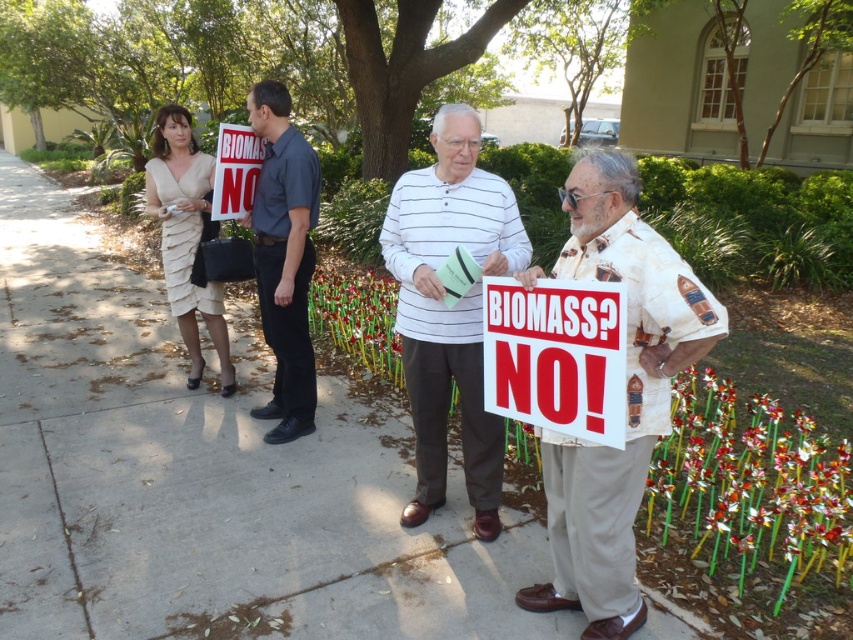
Question: Is beige printed shirt at right positioned behind red plastic sign at center?

Choices:
 (A) no
 (B) yes

Answer: (A)

Question: Which is farther from the beige printed shirt at right?

Choices:
 (A) dark blue shirt at center
 (B) red plastic sign at center
 (C) white striped shirt at center
 (D) concrete sidewalk at center

Answer: (D)

Question: Is beige printed shirt at right further to camera compared to red plastic sign at center?

Choices:
 (A) yes
 (B) no

Answer: (B)

Question: Which point is closer to the camera?

Choices:
 (A) red plastic sign at center
 (B) beige textured dress at left
 (C) white paper sign at center

Answer: (A)

Question: Which object is closer to the camera taking this photo?

Choices:
 (A) beige printed shirt at right
 (B) white paper sign at center
 (C) concrete sidewalk at center

Answer: (A)

Question: Does concrete sidewalk at center have a greater width compared to beige printed shirt at right?

Choices:
 (A) yes
 (B) no

Answer: (A)